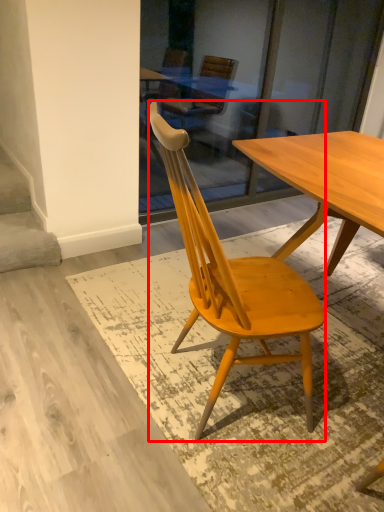
Question: From the image's perspective, considering the relative positions of chair (annotated by the red box) and stairwell in the image provided, where is chair (annotated by the red box) located with respect to the staircase?

Choices:
 (A) below
 (B) above

Answer: (A)